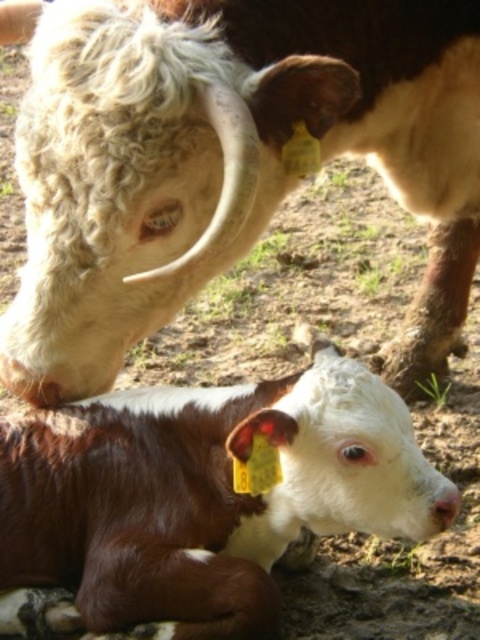
Question: Which of the following is the farthest from the observer?

Choices:
 (A) white woolen head at upper left
 (B) brown glossy calf at lower left

Answer: (B)

Question: In this image, where is white woolen head at upper left located relative to brown glossy calf at lower left?

Choices:
 (A) right
 (B) left

Answer: (A)

Question: Which of the following is the farthest from the observer?

Choices:
 (A) white woolen head at upper left
 (B) brown glossy calf at lower left

Answer: (B)

Question: Does white woolen head at upper left have a larger size compared to brown glossy calf at lower left?

Choices:
 (A) yes
 (B) no

Answer: (A)

Question: Is white woolen head at upper left to the left of brown glossy calf at lower left from the viewer's perspective?

Choices:
 (A) no
 (B) yes

Answer: (A)